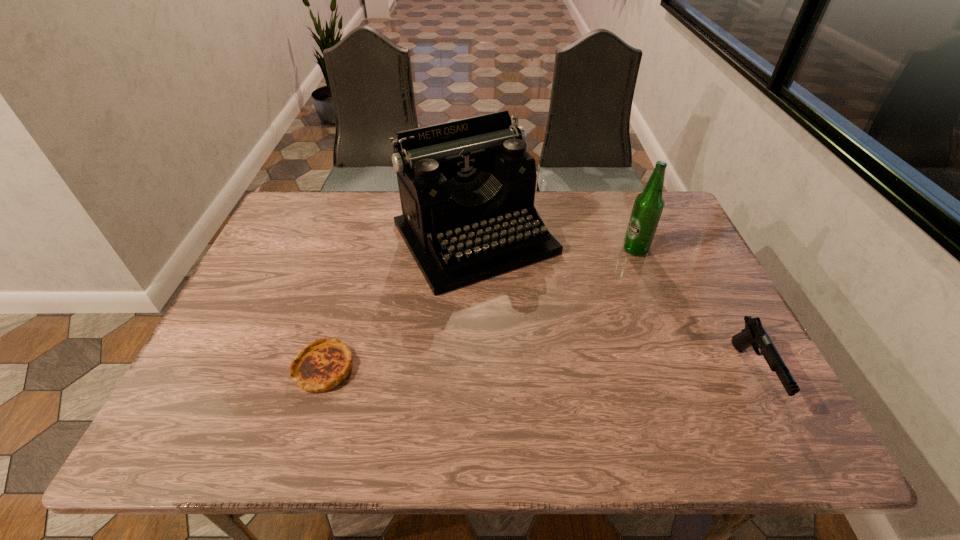
Where is `blank region between the rightmost object and the third object from left to right`? The width and height of the screenshot is (960, 540). blank region between the rightmost object and the third object from left to right is located at coordinates (693, 312).

Locate an element on the screen. vacant area between the rightmost object and the shortest object is located at coordinates (538, 370).

Identify the location of free area in between the third tallest object and the quiche. Image resolution: width=960 pixels, height=540 pixels. (538, 370).

This screenshot has width=960, height=540. I want to click on free space between the shortest object and the rightmost object, so click(538, 370).

Locate an element on the screen. vacant area that lies between the leftmost object and the third object from left to right is located at coordinates pos(479,308).

Identify which object is located as the third nearest to the rightmost object. Please provide its 2D coordinates. Your answer should be formatted as a tuple, i.e. [(x, y)], where the tuple contains the x and y coordinates of a point satisfying the conditions above.

[(323, 364)]

Identify which object is located as the third nearest to the rightmost object. Please provide its 2D coordinates. Your answer should be formatted as a tuple, i.e. [(x, y)], where the tuple contains the x and y coordinates of a point satisfying the conditions above.

[(323, 364)]